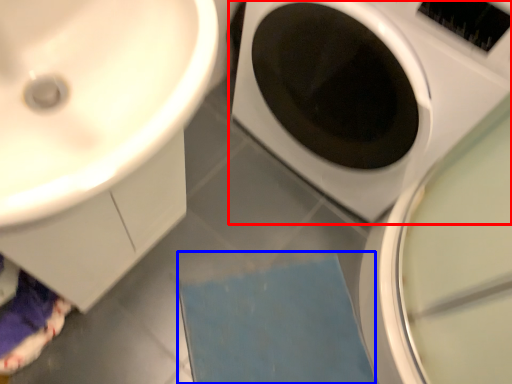
Question: Which point is further to the camera, washing machine (highlighted by a red box) or bath mat (highlighted by a blue box)?

Choices:
 (A) washing machine
 (B) bath mat

Answer: (B)